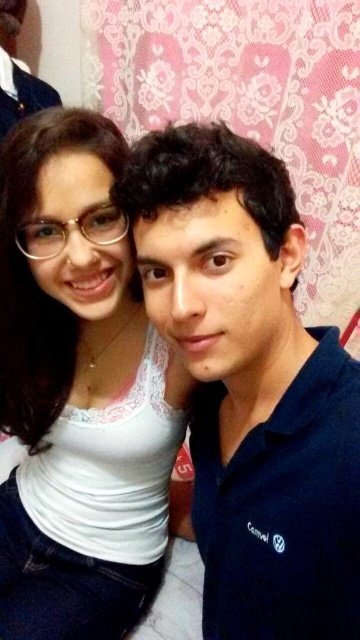
How far apart are blue cotton polo shirt at center and matte black shirt at upper left?

A distance of 4.31 feet exists between blue cotton polo shirt at center and matte black shirt at upper left.

Who is positioned more to the right, blue cotton polo shirt at center or matte black shirt at upper left?

Positioned to the right is blue cotton polo shirt at center.

Between point (349, 593) and point (11, 112), which one is positioned in front?

Point (349, 593) is more forward.

Image resolution: width=360 pixels, height=640 pixels. I want to click on blue cotton polo shirt at center, so click(x=251, y=385).

In the scene shown: Can you confirm if white lace top at upper left is wider than matte black shirt at upper left?

Yes, white lace top at upper left is wider than matte black shirt at upper left.

Between white lace top at upper left and matte black shirt at upper left, which one appears on the right side from the viewer's perspective?

Positioned to the right is white lace top at upper left.

Describe the element at coordinates (78, 390) in the screenshot. I see `white lace top at upper left` at that location.

The width and height of the screenshot is (360, 640). In order to click on white lace top at upper left in this screenshot , I will do `click(78, 390)`.

Is blue cotton polo shirt at center thinner than white lace top at upper left?

Indeed, blue cotton polo shirt at center has a lesser width compared to white lace top at upper left.

This screenshot has width=360, height=640. What do you see at coordinates (251, 385) in the screenshot?
I see `blue cotton polo shirt at center` at bounding box center [251, 385].

Where is `blue cotton polo shirt at center`? blue cotton polo shirt at center is located at coordinates (251, 385).